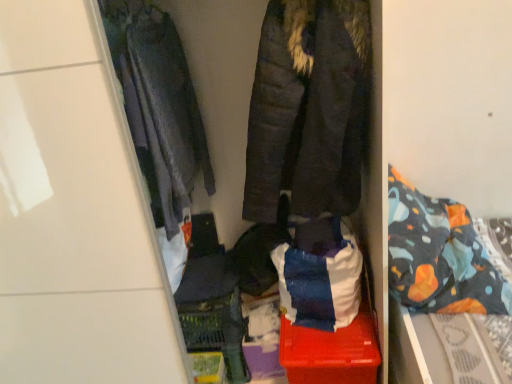
The width and height of the screenshot is (512, 384). What do you see at coordinates (158, 105) in the screenshot?
I see `dark gray quilted jacket at left, which appears as the second jacket when viewed from the right` at bounding box center [158, 105].

Where is `textured fabric coat at center`? This screenshot has width=512, height=384. textured fabric coat at center is located at coordinates (332, 124).

The width and height of the screenshot is (512, 384). I want to click on dark brown quilted jacket at center, the 2th jacket when ordered from left to right, so click(308, 108).

Between red plastic storage box at center and dark brown quilted jacket at center, positioned as the 1th jacket in right-to-left order, which one appears on the left side from the viewer's perspective?

dark brown quilted jacket at center, positioned as the 1th jacket in right-to-left order.

Are red plastic storage box at center and dark brown quilted jacket at center, positioned as the 1th jacket in right-to-left order, located far from each other?

red plastic storage box at center is near dark brown quilted jacket at center, positioned as the 1th jacket in right-to-left order, not far away.

Consider the image. Considering the sizes of objects red plastic storage box at center and dark brown quilted jacket at center, the 2th jacket when ordered from left to right, in the image provided, who is wider, red plastic storage box at center or dark brown quilted jacket at center, the 2th jacket when ordered from left to right,?

red plastic storage box at center.

Consider the image. Between textured fabric coat at center and dark gray quilted jacket at left, the 1th jacket in the left-to-right sequence, which one has smaller size?

dark gray quilted jacket at left, the 1th jacket in the left-to-right sequence.

How distant is textured fabric coat at center from dark gray quilted jacket at left, the 1th jacket in the left-to-right sequence?

A distance of 17.75 inches exists between textured fabric coat at center and dark gray quilted jacket at left, the 1th jacket in the left-to-right sequence.

Is textured fabric coat at center to the left of dark gray quilted jacket at left, the 1th jacket in the left-to-right sequence, from the viewer's perspective?

Yes, textured fabric coat at center is to the left of dark gray quilted jacket at left, the 1th jacket in the left-to-right sequence.

This screenshot has height=384, width=512. I want to click on closet below the dark gray quilted jacket at left, the 1th jacket in the left-to-right sequence (from a real-world perspective), so (332, 124).

From a real-world perspective, which object stands above the other?

textured fabric coat at center, from a real-world perspective.

Considering the sizes of objects patterned fabric bed at right and textured fabric coat at center in the image provided, who is wider, patterned fabric bed at right or textured fabric coat at center?

textured fabric coat at center is wider.

Can you confirm if patterned fabric bed at right is smaller than textured fabric coat at center?

Yes.

From a real-world perspective, relative to textured fabric coat at center, is dark brown quilted jacket at center, positioned as the 1th jacket in right-to-left order, vertically above or below?

dark brown quilted jacket at center, positioned as the 1th jacket in right-to-left order, is above textured fabric coat at center.

Is dark brown quilted jacket at center, the 2th jacket when ordered from left to right, oriented towards textured fabric coat at center?

Yes, dark brown quilted jacket at center, the 2th jacket when ordered from left to right, faces towards textured fabric coat at center.

Can we say dark brown quilted jacket at center, positioned as the 1th jacket in right-to-left order, lies outside textured fabric coat at center?

That's incorrect, dark brown quilted jacket at center, positioned as the 1th jacket in right-to-left order, is not completely outside textured fabric coat at center.

Is dark brown quilted jacket at center, positioned as the 1th jacket in right-to-left order, wider or thinner than textured fabric coat at center?

Clearly, dark brown quilted jacket at center, positioned as the 1th jacket in right-to-left order, has less width compared to textured fabric coat at center.

Is point (207, 154) closer to camera compared to point (350, 43)?

No.

Are dark gray quilted jacket at left, the 1th jacket in the left-to-right sequence, and dark brown quilted jacket at center, the 2th jacket when ordered from left to right, making contact?

No, dark gray quilted jacket at left, the 1th jacket in the left-to-right sequence, is not with dark brown quilted jacket at center, the 2th jacket when ordered from left to right.

Looking at this image, considering the positions of objects dark gray quilted jacket at left, the 1th jacket in the left-to-right sequence, and dark brown quilted jacket at center, the 2th jacket when ordered from left to right, in the image provided, who is more to the left, dark gray quilted jacket at left, the 1th jacket in the left-to-right sequence, or dark brown quilted jacket at center, the 2th jacket when ordered from left to right,?

From the viewer's perspective, dark gray quilted jacket at left, the 1th jacket in the left-to-right sequence, appears more on the left side.

Is point (332, 173) closer or farther from the camera than point (332, 338)?

Clearly, point (332, 173) is closer to the camera than point (332, 338).

From a real-world perspective, who is located higher, dark brown quilted jacket at center, positioned as the 1th jacket in right-to-left order, or red plastic storage box at center?

dark brown quilted jacket at center, positioned as the 1th jacket in right-to-left order, from a real-world perspective.

Who is shorter, dark brown quilted jacket at center, the 2th jacket when ordered from left to right, or red plastic storage box at center?

red plastic storage box at center.

Is dark brown quilted jacket at center, the 2th jacket when ordered from left to right, bigger or smaller than red plastic storage box at center?

Clearly, dark brown quilted jacket at center, the 2th jacket when ordered from left to right, is larger in size than red plastic storage box at center.

Would you say dark brown quilted jacket at center, positioned as the 1th jacket in right-to-left order, is part of textured fabric coat at center's contents?

Yes.

Is point (318, 207) in front of point (291, 180)?

Yes, it is.

Are textured fabric coat at center and dark brown quilted jacket at center, the 2th jacket when ordered from left to right, beside each other?

Yes, textured fabric coat at center is touching dark brown quilted jacket at center, the 2th jacket when ordered from left to right.

Where is `storage box lying on the right of dark brown quilted jacket at center, the 2th jacket when ordered from left to right`? storage box lying on the right of dark brown quilted jacket at center, the 2th jacket when ordered from left to right is located at coordinates (331, 352).

Locate an element on the screen. The width and height of the screenshot is (512, 384). the 2nd jacket behind the textured fabric coat at center is located at coordinates click(158, 105).

Looking at the image, which one is located closer to textured fabric coat at center, patterned fabric bed at right or dark brown quilted jacket at center, positioned as the 1th jacket in right-to-left order?

dark brown quilted jacket at center, positioned as the 1th jacket in right-to-left order, is closer to textured fabric coat at center.

Looking at this image, looking at the image, which one is located closer to textured fabric coat at center, dark gray quilted jacket at left, which appears as the second jacket when viewed from the right, or red plastic storage box at center?

Based on the image, dark gray quilted jacket at left, which appears as the second jacket when viewed from the right, appears to be nearer to textured fabric coat at center.

From the image, which object appears to be farther from patterned fabric bed at right, textured fabric coat at center or dark brown quilted jacket at center, positioned as the 1th jacket in right-to-left order?

dark brown quilted jacket at center, positioned as the 1th jacket in right-to-left order.

Based on their spatial positions, is textured fabric coat at center or dark brown quilted jacket at center, positioned as the 1th jacket in right-to-left order, closer to dark gray quilted jacket at left, the 1th jacket in the left-to-right sequence?

dark brown quilted jacket at center, positioned as the 1th jacket in right-to-left order, is closer to dark gray quilted jacket at left, the 1th jacket in the left-to-right sequence.

Considering their positions, is red plastic storage box at center positioned further to dark brown quilted jacket at center, the 2th jacket when ordered from left to right, than patterned fabric bed at right?

Among the two, red plastic storage box at center is located further to dark brown quilted jacket at center, the 2th jacket when ordered from left to right.

Considering their positions, is red plastic storage box at center positioned further to dark gray quilted jacket at left, which appears as the second jacket when viewed from the right, than dark brown quilted jacket at center, positioned as the 1th jacket in right-to-left order?

red plastic storage box at center is further to dark gray quilted jacket at left, which appears as the second jacket when viewed from the right.

Looking at the image, which one is located further to patterned fabric bed at right, dark gray quilted jacket at left, the 1th jacket in the left-to-right sequence, or dark brown quilted jacket at center, positioned as the 1th jacket in right-to-left order?

Based on the image, dark gray quilted jacket at left, the 1th jacket in the left-to-right sequence, appears to be further to patterned fabric bed at right.

Based on their spatial positions, is dark gray quilted jacket at left, the 1th jacket in the left-to-right sequence, or patterned fabric bed at right closer to textured fabric coat at center?

patterned fabric bed at right lies closer to textured fabric coat at center than the other object.

What are the coordinates of `jacket located between dark gray quilted jacket at left, which appears as the second jacket when viewed from the right, and patterned fabric bed at right in the left-right direction` in the screenshot? It's located at (308, 108).

The width and height of the screenshot is (512, 384). What are the coordinates of `storage box between textured fabric coat at center and patterned fabric bed at right` in the screenshot? It's located at (331, 352).

Where is `storage box between dark gray quilted jacket at left, the 1th jacket in the left-to-right sequence, and patterned fabric bed at right`? The height and width of the screenshot is (384, 512). storage box between dark gray quilted jacket at left, the 1th jacket in the left-to-right sequence, and patterned fabric bed at right is located at coordinates (331, 352).

Where is `bed between dark brown quilted jacket at center, positioned as the 1th jacket in right-to-left order, and red plastic storage box at center in the up-down direction`? bed between dark brown quilted jacket at center, positioned as the 1th jacket in right-to-left order, and red plastic storage box at center in the up-down direction is located at coordinates (435, 266).